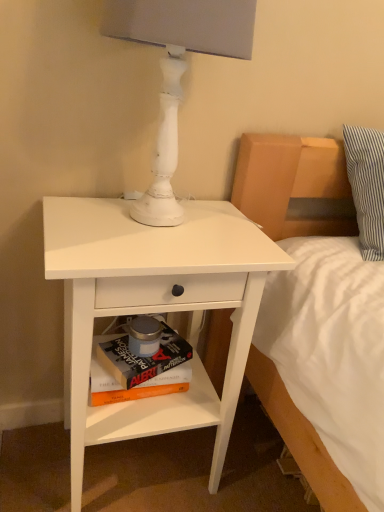
Question: Can you confirm if white painted wood table lamp at upper center is wider than hardcover book at lower center, the 2th paperback book in the bottom-to-top sequence?

Choices:
 (A) yes
 (B) no

Answer: (A)

Question: Is white painted wood table lamp at upper center far from hardcover book at lower center, the 2th paperback book in the bottom-to-top sequence?

Choices:
 (A) yes
 (B) no

Answer: (B)

Question: Can hardcover book at lower center, positioned as the 1th paperback book in top-to-bottom order, be found inside white painted wood table lamp at upper center?

Choices:
 (A) yes
 (B) no

Answer: (B)

Question: From a real-world perspective, is white painted wood table lamp at upper center physically above hardcover book at lower center, the 2th paperback book in the bottom-to-top sequence?

Choices:
 (A) yes
 (B) no

Answer: (A)

Question: Is white painted wood table lamp at upper center positioned with its back to hardcover book at lower center, positioned as the 1th paperback book in top-to-bottom order?

Choices:
 (A) no
 (B) yes

Answer: (A)

Question: Is the position of white painted wood table lamp at upper center more distant than that of hardcover book at lower center, positioned as the 1th paperback book in top-to-bottom order?

Choices:
 (A) yes
 (B) no

Answer: (B)

Question: Is hardcover book at lower center, arranged as the 2th paperback book when viewed from the top, to the left of hardcover book at lower center, positioned as the 1th paperback book in top-to-bottom order, from the viewer's perspective?

Choices:
 (A) yes
 (B) no

Answer: (A)

Question: From a real-world perspective, is hardcover book at lower center, positioned as the 1th paperback book in bottom-to-top order, positioned over hardcover book at lower center, positioned as the 1th paperback book in top-to-bottom order, based on gravity?

Choices:
 (A) no
 (B) yes

Answer: (A)

Question: From the image's perspective, would you say hardcover book at lower center, positioned as the 1th paperback book in bottom-to-top order, is shown under hardcover book at lower center, the 2th paperback book in the bottom-to-top sequence?

Choices:
 (A) no
 (B) yes

Answer: (B)

Question: From the image's perspective, is hardcover book at lower center, arranged as the 2th paperback book when viewed from the top, on hardcover book at lower center, positioned as the 1th paperback book in top-to-bottom order?

Choices:
 (A) yes
 (B) no

Answer: (B)

Question: Is hardcover book at lower center, positioned as the 1th paperback book in bottom-to-top order, touching hardcover book at lower center, the 2th paperback book in the bottom-to-top sequence?

Choices:
 (A) no
 (B) yes

Answer: (B)

Question: Considering the relative positions of hardcover book at lower center, arranged as the 2th paperback book when viewed from the top, and hardcover book at lower center, the 2th paperback book in the bottom-to-top sequence, in the image provided, is hardcover book at lower center, arranged as the 2th paperback book when viewed from the top, to the right of hardcover book at lower center, the 2th paperback book in the bottom-to-top sequence, from the viewer's perspective?

Choices:
 (A) yes
 (B) no

Answer: (B)

Question: Does white painted wood table lamp at upper center have a lesser height compared to white matte nightstand at lower left?

Choices:
 (A) yes
 (B) no

Answer: (A)